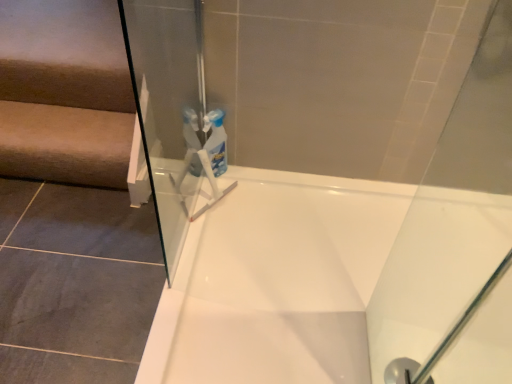
This screenshot has width=512, height=384. In order to click on vacant point above beige fabric stairwell at left (from a real-world perspective) in this screenshot , I will do `click(53, 120)`.